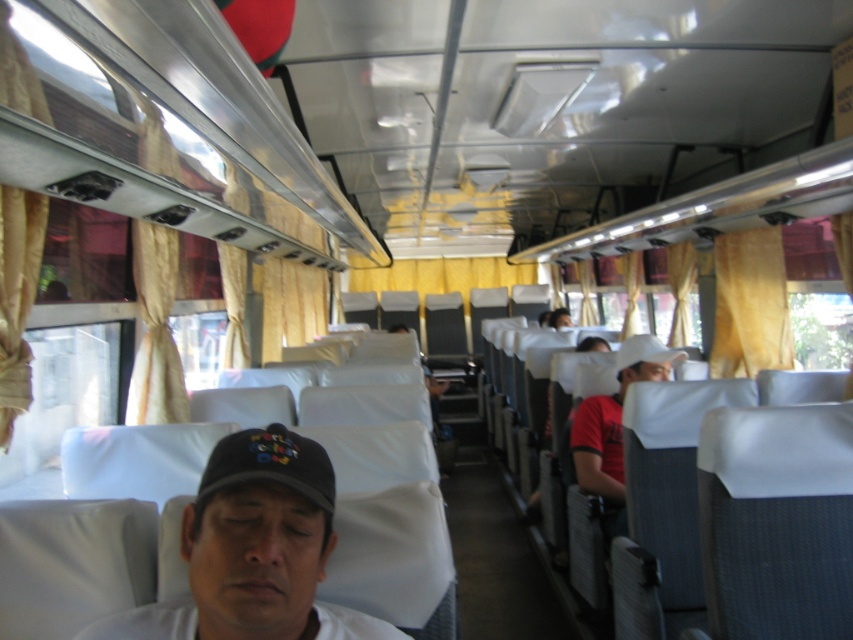
You are a passenger sitting in the bus and notice an object placed at a specific location. Where exactly is the white matte cap at center positioned in terms of coordinates?

The white matte cap at center is located at coordinates point (254, 550).

You are a passenger sitting in the bus and want to take a photo of both the point at (260, 451) and the point at (618, 364). Which point should you focus on first to ensure both are in focus?

You should focus on the point at (260, 451) first because it is closer to the camera than the point at (618, 364). This way, adjusting the focus from near to far will help both points come into focus.

You are a passenger sitting in the bus and want to check the time outside. You see a yellow fabric curtain at right and a white matte baseball cap at center. Which object is located to the right side of the other?

The yellow fabric curtain at right is to the right of the white matte baseball cap at center.